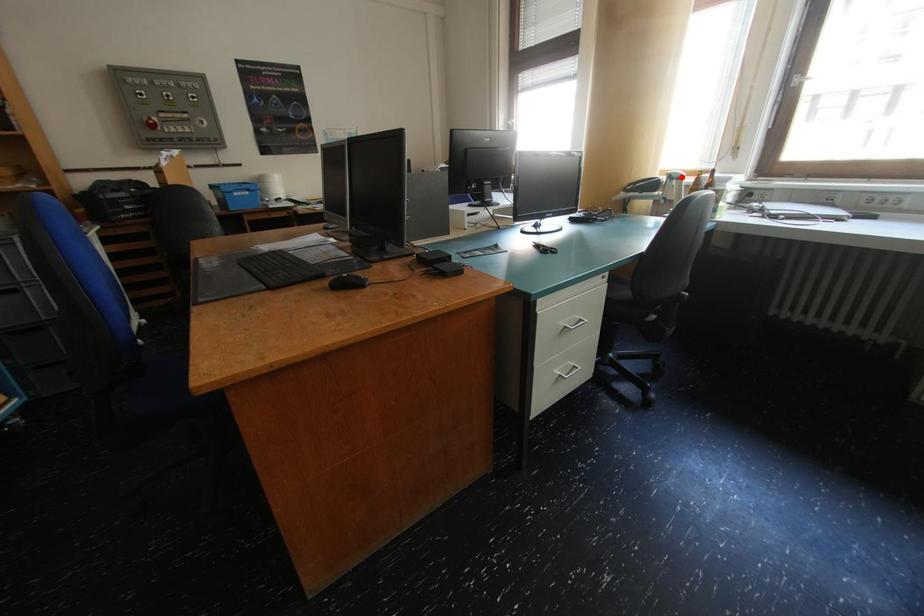
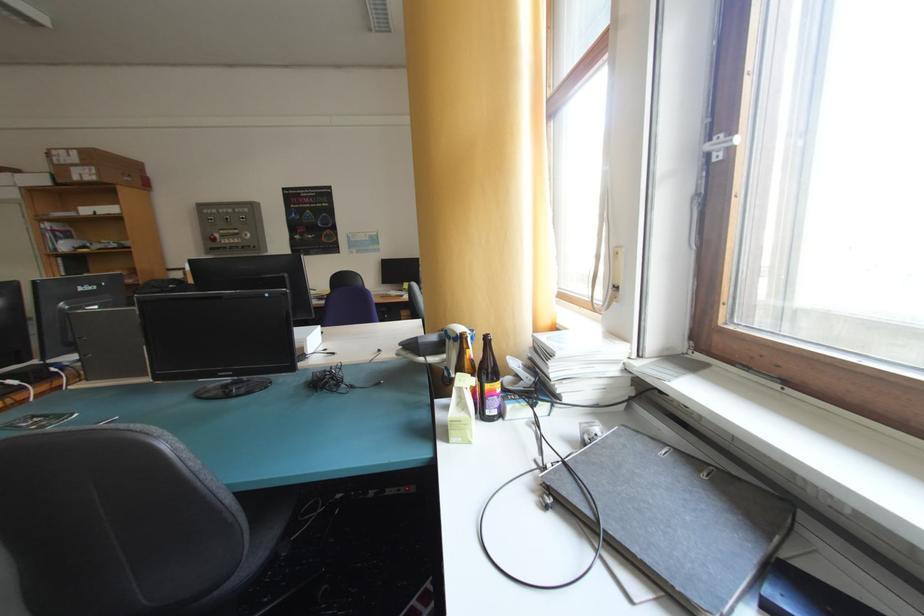
Question: I am providing you with two images of the same scene from different viewpoints. A red point is shown in image1. For the corresponding object point in image2, is it positioned nearer or farther from the camera?

Choices:
 (A) Nearer
 (B) Farther

Answer: (B)